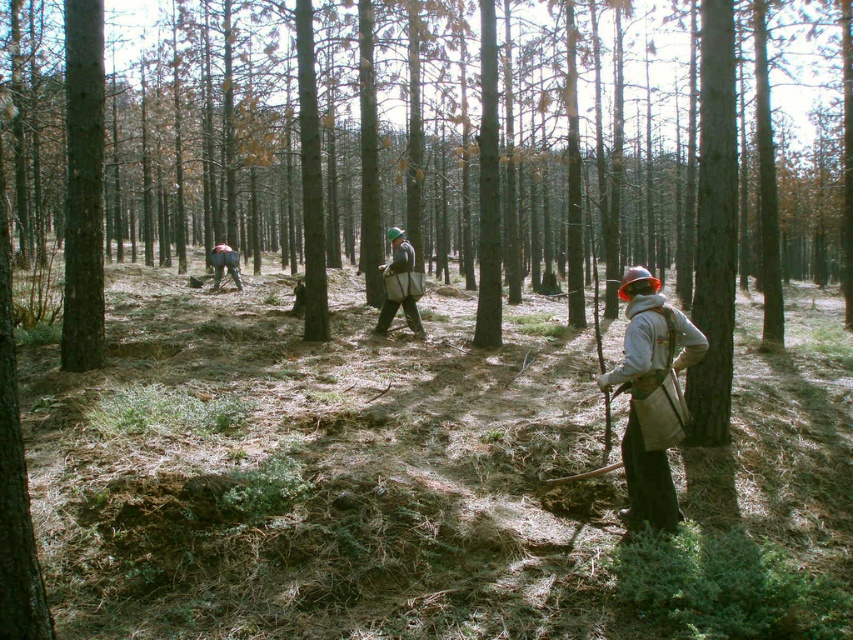
You are a hiker who has spotted two workers in the forest. You see a gray fabric shirt at center and a dark gray uniform at center. Which worker is standing to the right of the other?

The gray fabric shirt at center is positioned on the right side of dark gray uniform at center.